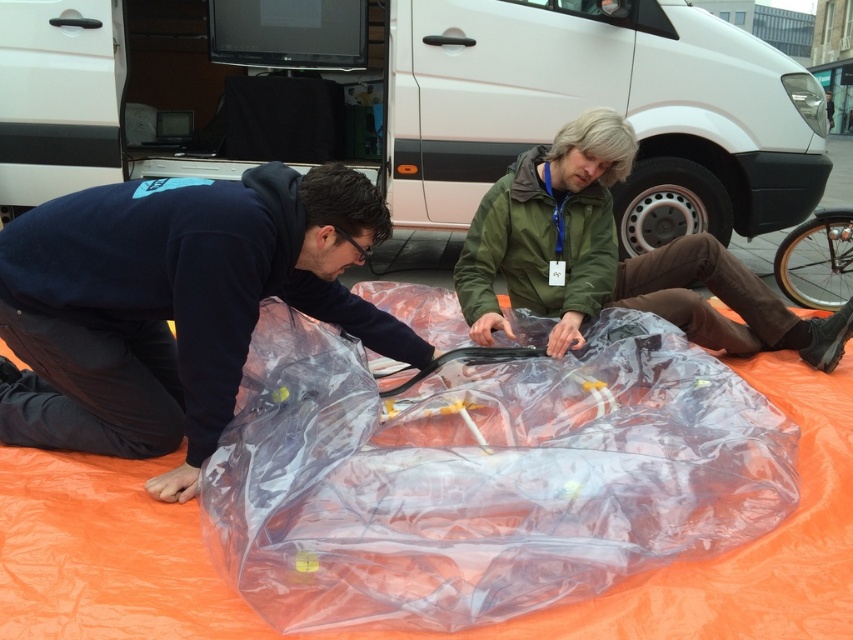
You are a delivery person who needs to deliver a package to the transparent plastic bag at left. The white matte van at upper center is blocking the path. Can you go around the van to reach the bag?

The transparent plastic bag at left is behind the white matte van at upper center, so you can go around the van to reach the bag since it is positioned behind the van.

You are standing at the center of the image and want to locate the white matte van at upper center. Which direction should you look to find it?

You should look upward and toward the center of the image to locate the white matte van at upper center, as it is positioned at point coordinates (x=434, y=104).

You are trying to determine which item is taller between the transparent plastic wrap at center and the transparent plastic bag at left. Based on the scene, which one is taller?

The transparent plastic bag at left is taller than the transparent plastic wrap at center.